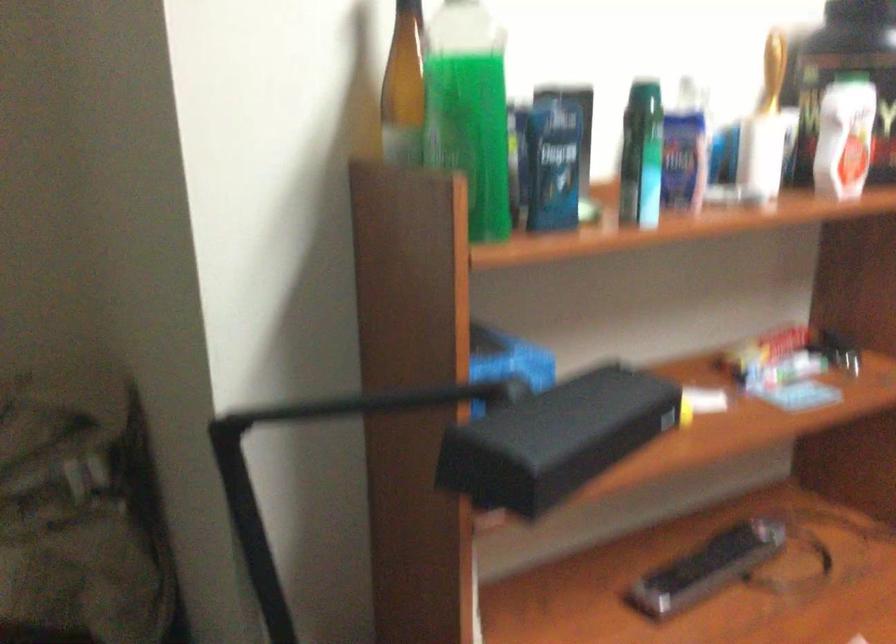
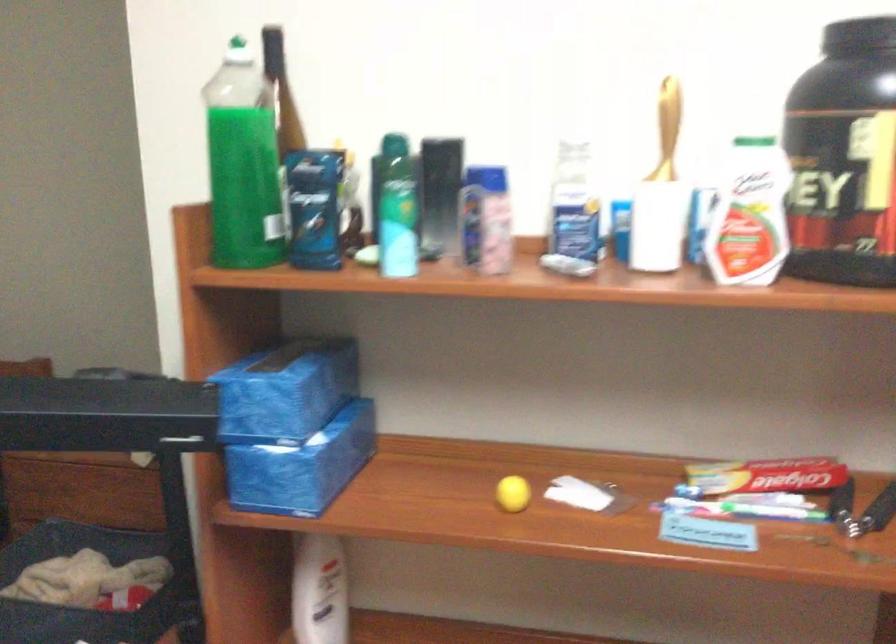
Locate, in the second image, the point that corresponds to point (565, 156) in the first image.

(314, 207)